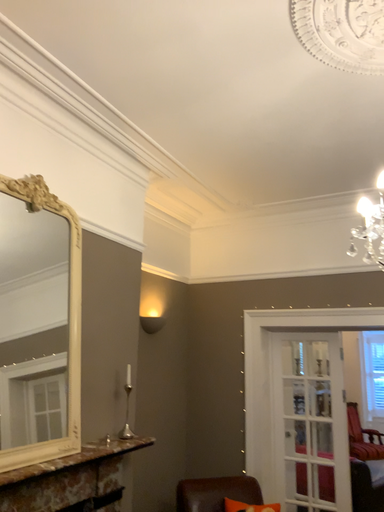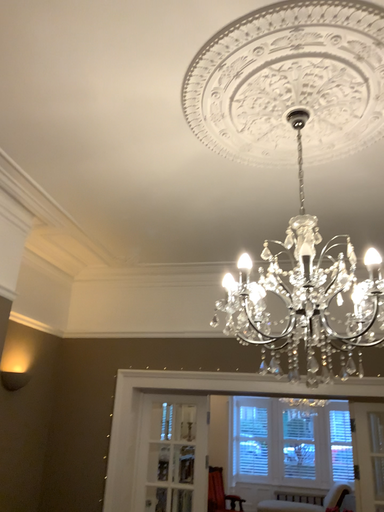
Question: Which way did the camera rotate in the video?

Choices:
 (A) rotated downward
 (B) rotated upward

Answer: (B)